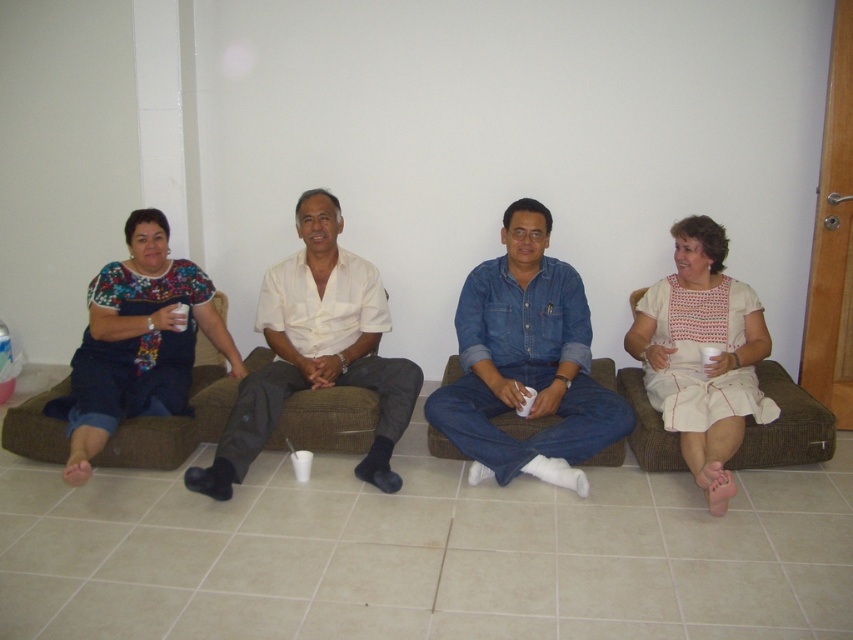
Can you confirm if denim shirt at center is positioned to the left of floral fabric dress at left?

No, denim shirt at center is not to the left of floral fabric dress at left.

Can you confirm if denim shirt at center is positioned below floral fabric dress at left?

Actually, denim shirt at center is above floral fabric dress at left.

Does point (532, 257) lie in front of point (125, 344)?

Yes, it is in front of point (125, 344).

Locate an element on the screen. The width and height of the screenshot is (853, 640). denim shirt at center is located at coordinates (526, 364).

Is denim shirt at center smaller than brown fabric couch at center?

No.

Can you confirm if denim shirt at center is positioned above brown fabric couch at center?

Indeed, denim shirt at center is positioned over brown fabric couch at center.

I want to click on denim shirt at center, so click(526, 364).

Between point (619, 432) and point (376, 458), which one is positioned in front?

Point (619, 432) is in front.

Measure the distance between point (519, 241) and camera.

Point (519, 241) is 10.23 feet away from camera.

Locate an element on the screen. Image resolution: width=853 pixels, height=640 pixels. denim shirt at center is located at coordinates (526, 364).